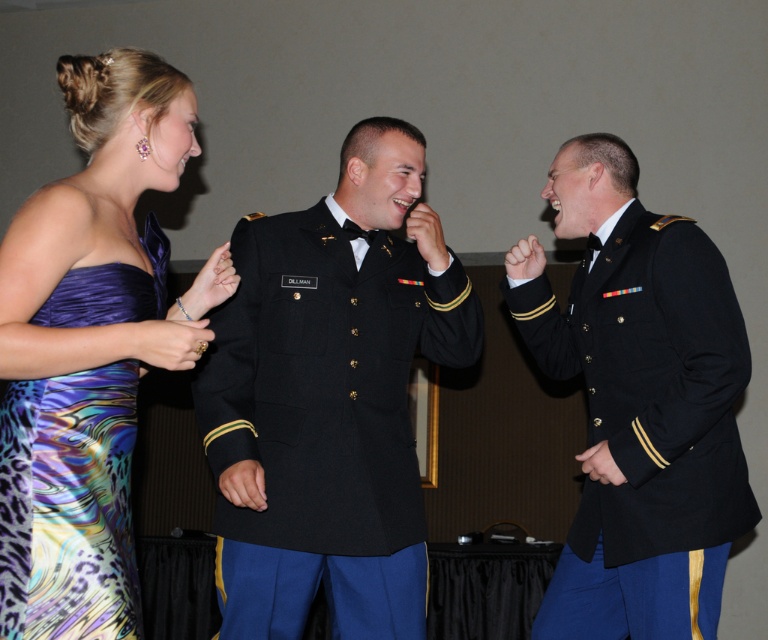
Looking at this image, based on the coordinates provided, which object corresponds to the point at (639,403)?

The point at (639,403) corresponds to the matte black uniform at center.

You are standing at the point marked as point (x=283, y=611) in the image. You want to greet the woman in the strapless gown with a vibrant multicolored pattern and the man in the military uniform with gold epaulets. Can you reach both of them without moving from your current position?

The distance between the woman in the strapless gown with a vibrant multicolored pattern and the man in the military uniform with gold epaulets is 8.04 feet. Since you are at point (x=283, y=611), you can reach both individuals without moving as they are within a reasonable distance from your position.

You are a photographer at the event and want to place a small light on the shiny satin dress at left. The coordinates provided are point (90, 348). Is this point located on the shiny satin dress at left?

Yes, the point (90, 348) is on the shiny satin dress at left according to the description.